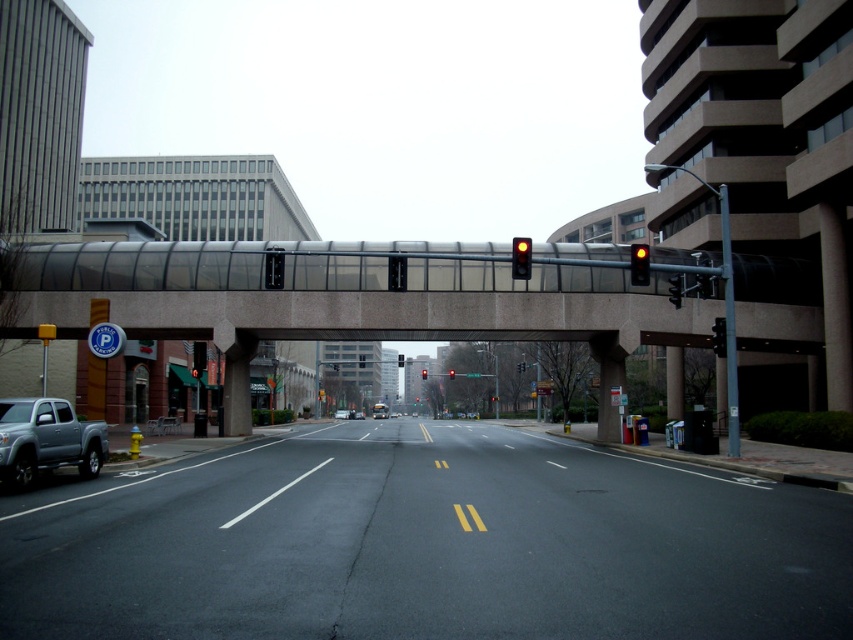
Question: Which point is closer to the camera?

Choices:
 (A) (16, 458)
 (B) (383, 404)
 (C) (271, 266)
 (D) (424, 374)

Answer: (A)

Question: Which point appears farthest from the camera in this image?

Choices:
 (A) tap(51, 456)
 (B) tap(448, 376)
 (C) tap(714, 333)
 (D) tap(337, 413)

Answer: (D)

Question: Observing the image, what is the correct spatial positioning of matte gray truck at lower left in reference to yellow glass traffic light at center?

Choices:
 (A) left
 (B) right

Answer: (A)

Question: Does yellow glass traffic light at center have a lesser width compared to red glass traffic light at upper center?

Choices:
 (A) yes
 (B) no

Answer: (B)

Question: Which of these objects is positioned farthest from the metallic traffic light at center?

Choices:
 (A) white glossy sedan at center
 (B) red glass traffic light at center

Answer: (A)

Question: Can you confirm if white glossy sedan at center is wider than silver metallic sedan at center?

Choices:
 (A) yes
 (B) no

Answer: (A)